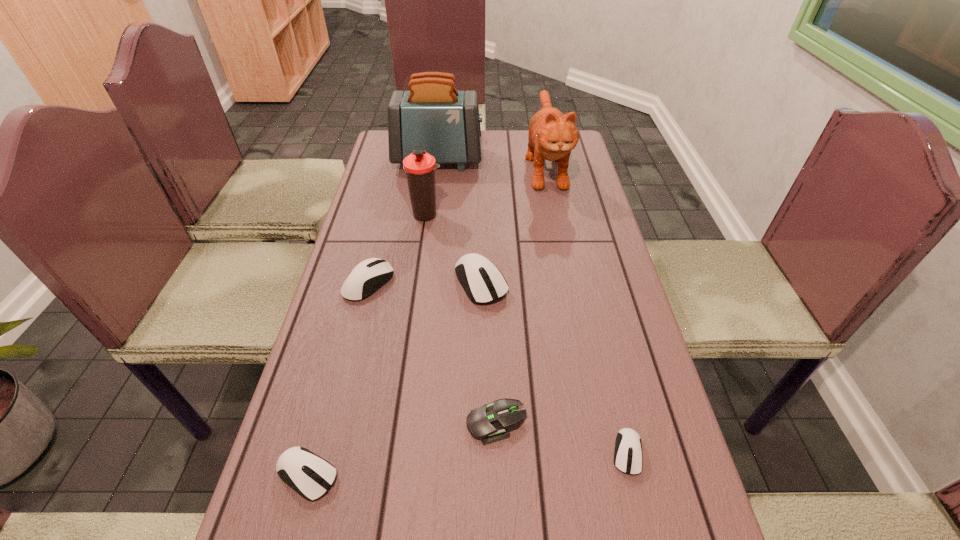
You are a GUI agent. You are given a task and a screenshot of the screen. Output one action in this format:
    pyautogui.click(x=<x>, y=<y>)
    Task: Click on the smallest white mouse
    This screenshot has width=960, height=540.
    Given the screenshot: What is the action you would take?
    pyautogui.click(x=628, y=458)

Find the location of `the rightmost computer mouse`. the rightmost computer mouse is located at coordinates (628, 458).

Find the location of a particular element. The image size is (960, 540). gray computer mouse is located at coordinates (489, 423).

Where is `vacant area located on the front-facing side of the toaster`? vacant area located on the front-facing side of the toaster is located at coordinates (536, 160).

Find the location of a particular element. Image resolution: width=960 pixels, height=540 pixels. free space located 0.100m on the face of the cat is located at coordinates (557, 222).

At what (x,y) coordinates should I click in order to perform the action: click on vacant space located 0.160m on the right of the third farthest object. Please return your answer as a coordinate pair (x, y). This screenshot has width=960, height=540. Looking at the image, I should click on (496, 214).

Find the location of a particular element. free space located 0.300m on the left of the second white mouse from right to left is located at coordinates (337, 282).

In order to click on vacant region located 0.310m on the back of the second biggest white mouse in this screenshot , I will do `click(390, 197)`.

Where is `vacant space located 0.070m on the back of the third tallest computer mouse`? This screenshot has height=540, width=960. vacant space located 0.070m on the back of the third tallest computer mouse is located at coordinates (x=324, y=414).

Find the location of a particular element. The width and height of the screenshot is (960, 540). free space located 0.350m on the back of the rightmost computer mouse is located at coordinates (589, 296).